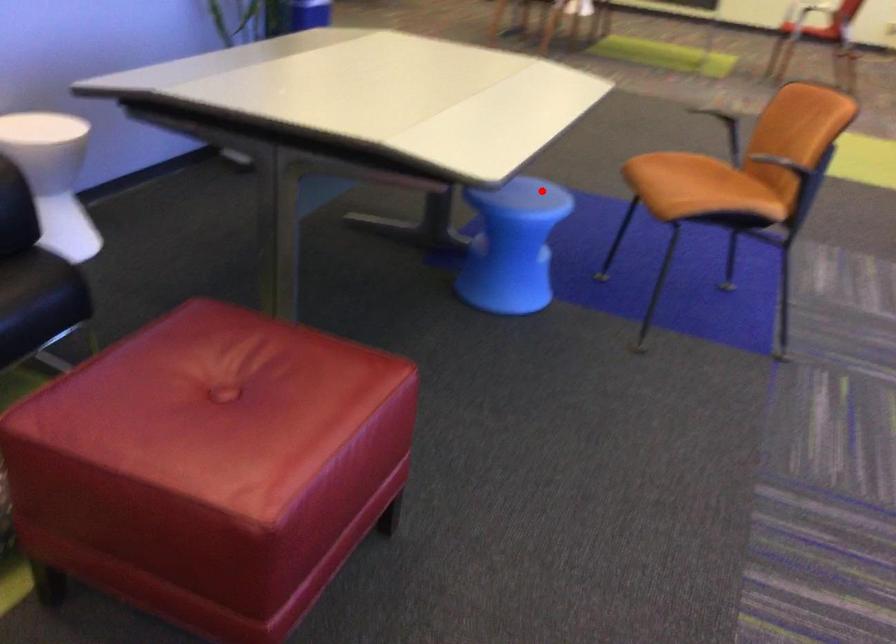
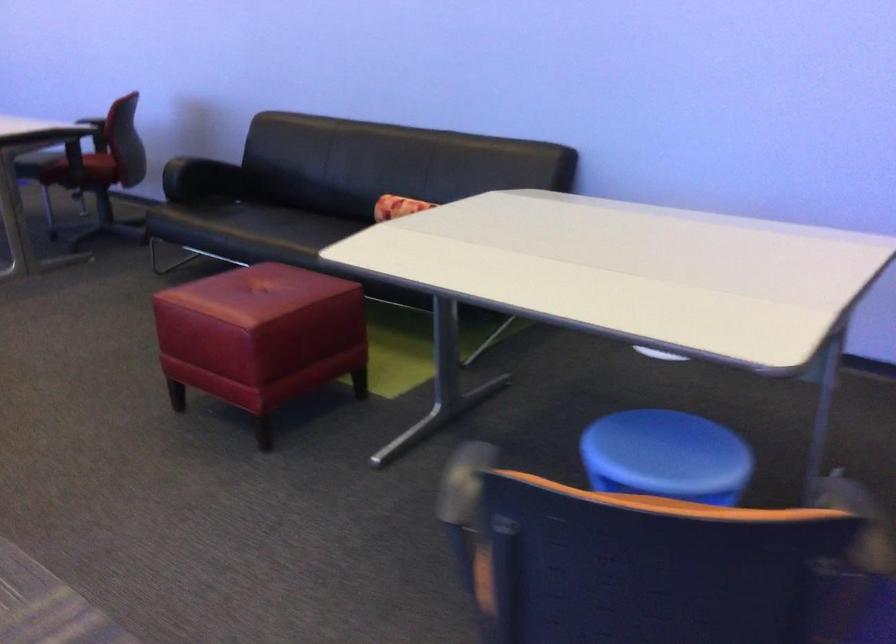
Locate, in the second image, the point that corresponds to the highlighted location in the first image.

(666, 456)